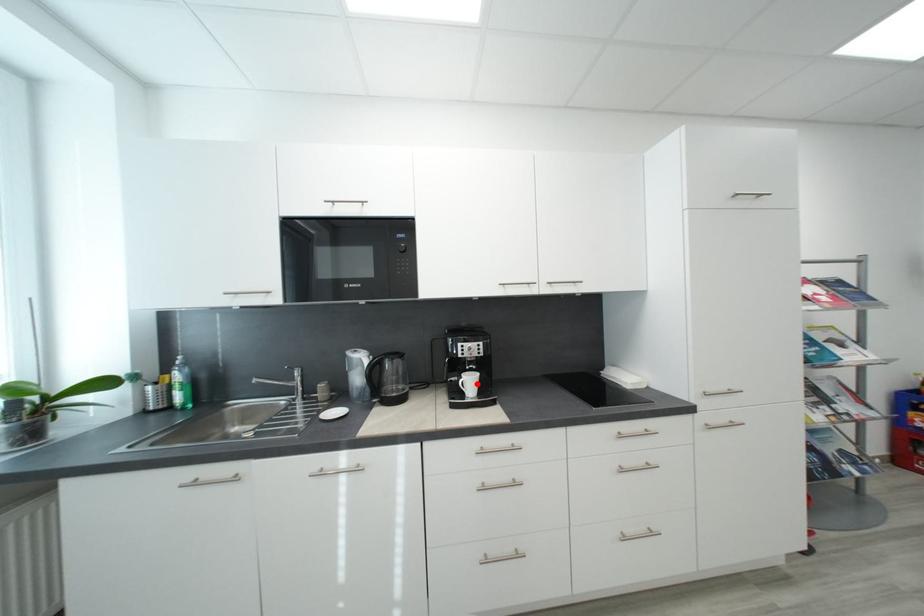
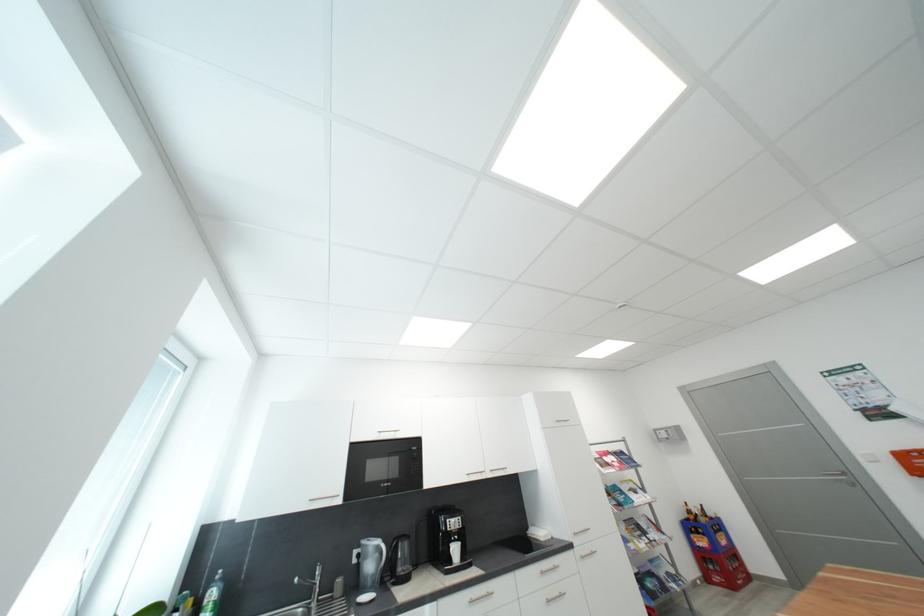
In the second image, find the point that corresponds to the highlighted location in the first image.

(463, 552)